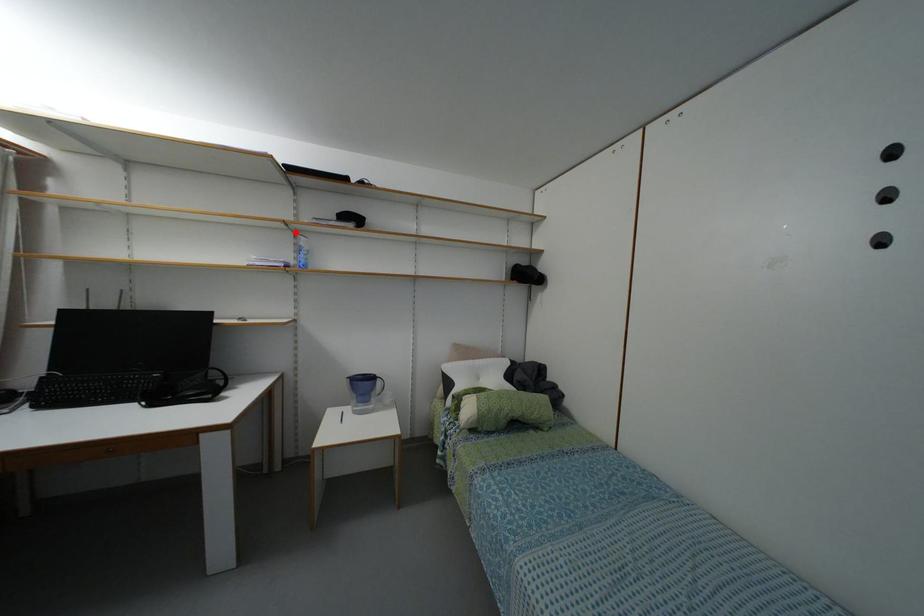
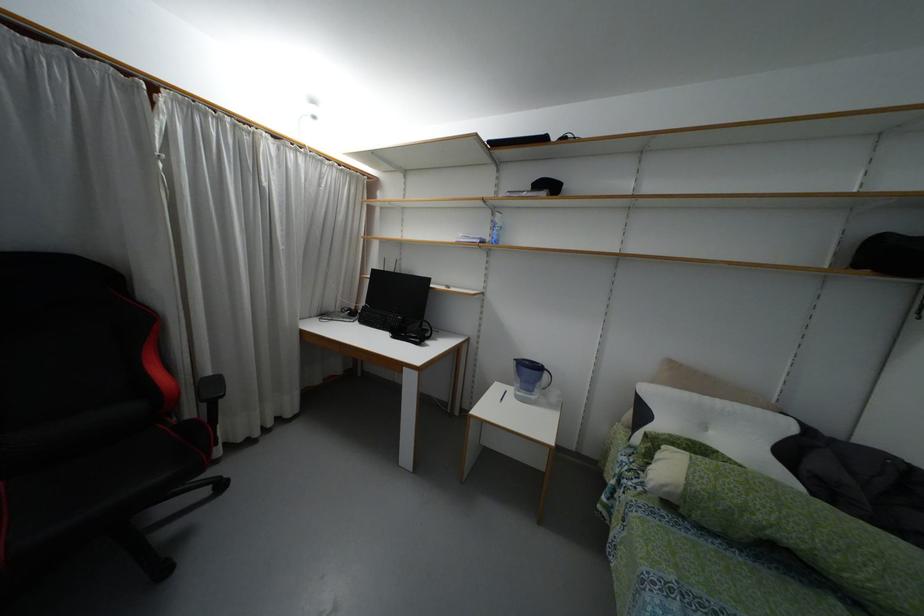
The point at the highlighted location is marked in the first image. Where is the corresponding point in the second image?

(493, 209)